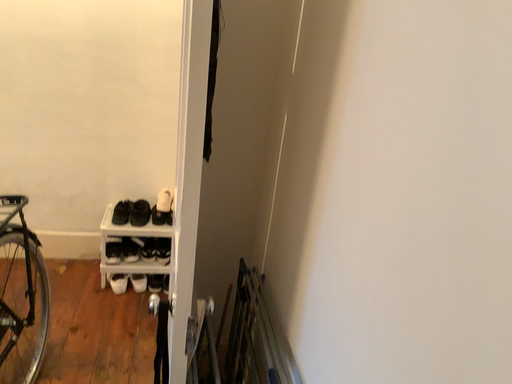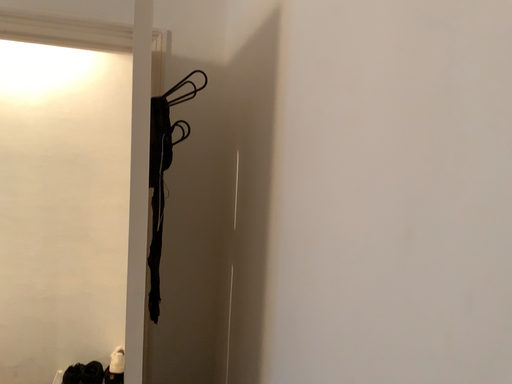
Question: Which way did the camera rotate in the video?

Choices:
 (A) rotated upward
 (B) rotated downward

Answer: (A)